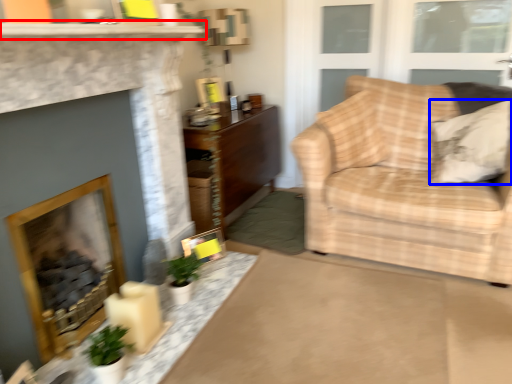
Question: Which object is closer to the camera taking this photo, mantle (highlighted by a red box) or pillow (highlighted by a blue box)?

Choices:
 (A) mantle
 (B) pillow

Answer: (A)